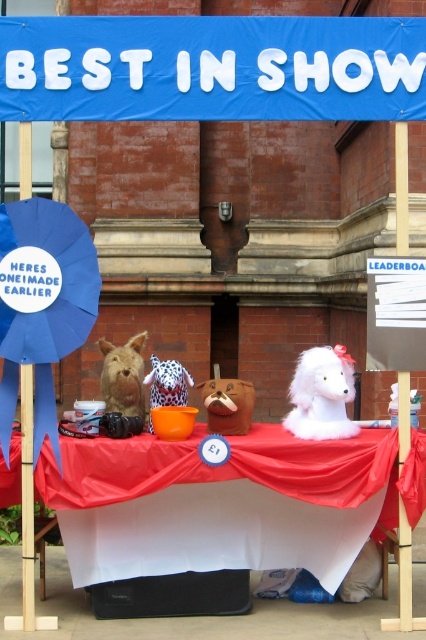
You are a photographer standing at the back of the room. You want to take a picture of the fuzzy brown stuffed animal at center so that it fits perfectly within the frame. The blue fabric canopy at upper center must also be visible in the background. Given that the distance between the two objects is 2.02 meters, what is the minimum focal length you should use to ensure both are in focus and properly framed?

The minimum focal length required would depend on the sensor size of your camera and the desired framing, but since the blue fabric canopy at upper center is 2.02 meters away from the fuzzy brown stuffed animal at center, you should use a focal length that allows both to be in the same frame while maintaining focus. A moderate focal length like 50mm on a full frame sensor might work, ensuring the canopy is in the background and the stuffed animal is centered.